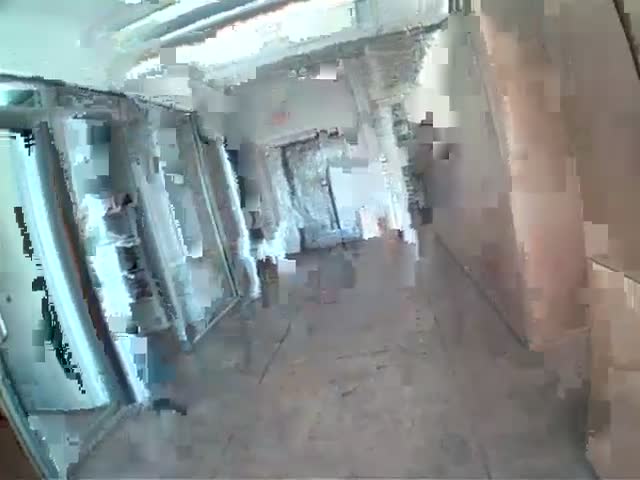
Identify the location of empty wall. The width and height of the screenshot is (640, 480). (490, 156), (579, 211).